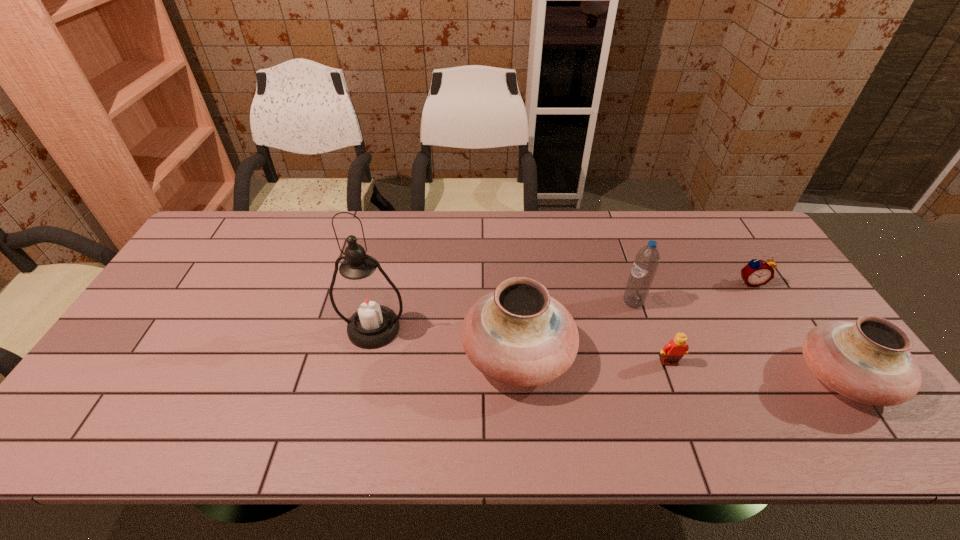
You are a GUI agent. You are given a task and a screenshot of the screen. Output one action in this format:
    pyautogui.click(x=<x>, y=<y>)
    Task: Click on the free space at the left edge
    This screenshot has height=540, width=960.
    Given the screenshot: What is the action you would take?
    pyautogui.click(x=127, y=343)

This screenshot has width=960, height=540. I want to click on empty space between the farthest object and the fifth object from right to left, so [x=635, y=319].

The image size is (960, 540). Identify the location of vacant space that is in between the taller pottery and the oil lamp. (445, 342).

Where is `free space between the third shortest object and the leftmost object`? The width and height of the screenshot is (960, 540). free space between the third shortest object and the leftmost object is located at coordinates (609, 353).

Locate an element on the screen. empty location between the fifth object from right to left and the Lego is located at coordinates (593, 359).

This screenshot has height=540, width=960. In order to click on empty location between the third shortest object and the farthest object in this screenshot , I will do `click(797, 330)`.

What are the coordinates of `empty space between the alarm clock and the Lego` in the screenshot? It's located at (710, 322).

In order to click on free space that is in between the fourth tallest object and the Lego in this screenshot , I will do `click(756, 370)`.

The image size is (960, 540). I want to click on vacant space that is in between the shorter pottery and the water bottle, so point(738,340).

Image resolution: width=960 pixels, height=540 pixels. I want to click on the second closest object relative to the shorter pottery, so click(x=672, y=352).